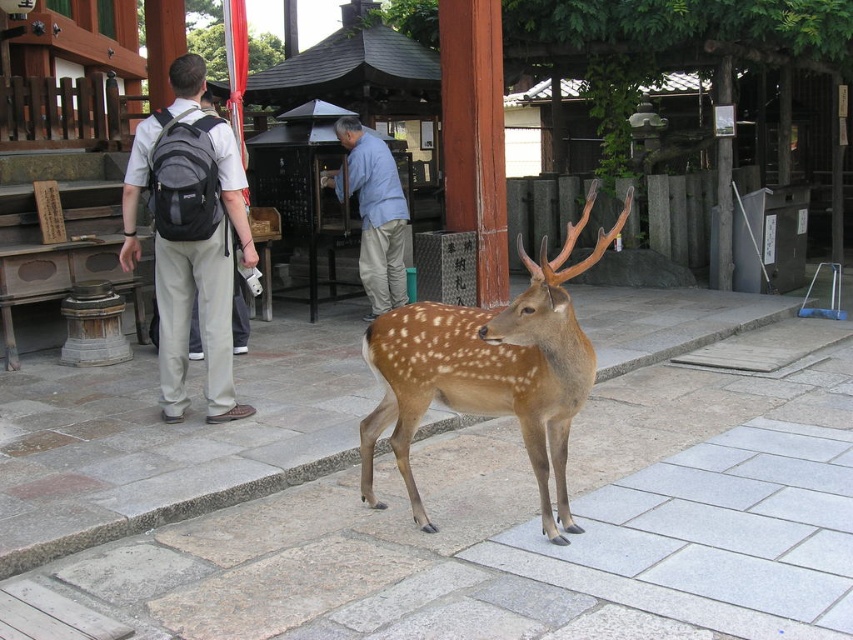
Question: Which object appears closest to the camera in this image?

Choices:
 (A) gray fabric backpack at upper left
 (B) brown speckled fur at center
 (C) light blue cotton shirt at center

Answer: (B)

Question: Does brown speckled fur at center lie in front of gray fabric backpack at upper left?

Choices:
 (A) no
 (B) yes

Answer: (B)

Question: Is brown speckled fur at center to the right of gray fabric backpack at upper left from the viewer's perspective?

Choices:
 (A) yes
 (B) no

Answer: (A)

Question: Is gray fabric backpack at upper left smaller than light blue cotton shirt at center?

Choices:
 (A) yes
 (B) no

Answer: (B)

Question: Which object appears farthest from the camera in this image?

Choices:
 (A) gray fabric backpack at upper left
 (B) light blue cotton shirt at center
 (C) brown speckled fur at center

Answer: (B)

Question: Among these points, which one is farthest from the camera?

Choices:
 (A) pos(544,384)
 (B) pos(222,358)
 (C) pos(323,173)

Answer: (C)